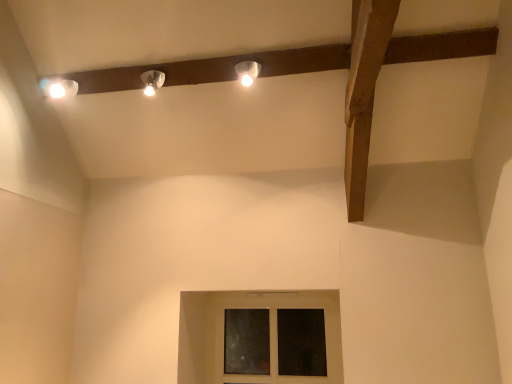
Question: Is transparent glass window at center taller or shorter than matte white lamp at upper center, which is counted as the second lamp, starting from the left?

Choices:
 (A) tall
 (B) short

Answer: (A)

Question: Is point (222, 357) positioned closer to the camera than point (244, 79)?

Choices:
 (A) farther
 (B) closer

Answer: (A)

Question: Which of these objects is positioned closest to the matte white lamp at upper center, the 1th lamp in the right-to-left sequence?

Choices:
 (A) matte white lamp at upper center, which is the first lamp in left-to-right order
 (B) transparent glass window at center

Answer: (A)

Question: Based on their relative distances, which object is farther from the matte white lamp at upper center, which is the first lamp in left-to-right order?

Choices:
 (A) matte white lamp at upper center, the 1th lamp in the right-to-left sequence
 (B) transparent glass window at center

Answer: (B)